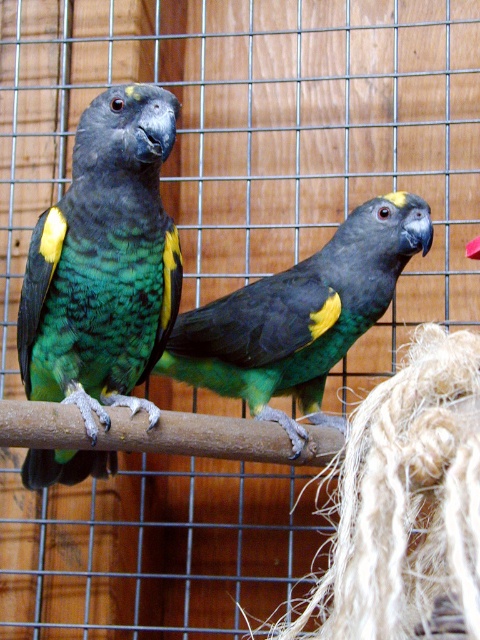
Question: Observing the image, what is the correct spatial positioning of green matte parrot at center in reference to brown wooden branch at center?

Choices:
 (A) right
 (B) left

Answer: (A)

Question: Based on their relative distances, which object is farther from the green matte parrot at center?

Choices:
 (A) brown wooden branch at center
 (B) green matte parrot at left

Answer: (B)

Question: Which object is the farthest from the green matte parrot at center?

Choices:
 (A) brown wooden branch at center
 (B) green matte parrot at left

Answer: (B)

Question: Does green matte parrot at left come behind green matte parrot at center?

Choices:
 (A) yes
 (B) no

Answer: (B)

Question: Is green matte parrot at left to the left of green matte parrot at center from the viewer's perspective?

Choices:
 (A) no
 (B) yes

Answer: (B)

Question: Which object is closer to the camera taking this photo?

Choices:
 (A) green matte parrot at left
 (B) green matte parrot at center

Answer: (A)